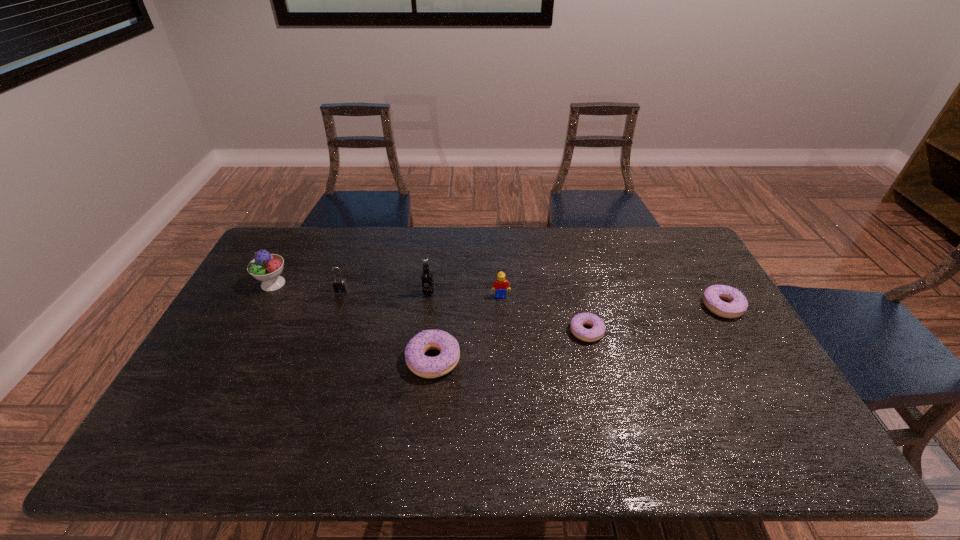
Where is `vacant space located on the left of the tallest doughnut`? The height and width of the screenshot is (540, 960). vacant space located on the left of the tallest doughnut is located at coordinates (325, 360).

At what (x,y) coordinates should I click in order to perform the action: click on free space located 0.260m on the right of the second doughnut from right to left. Please return your answer as a coordinate pair (x, y). Looking at the image, I should click on (693, 332).

This screenshot has height=540, width=960. What are the coordinates of `vacant space located 0.350m on the back of the rightmost object` in the screenshot? It's located at (678, 230).

The height and width of the screenshot is (540, 960). What are the coordinates of `free space located 0.300m on the front-facing side of the third object from right to left` in the screenshot? It's located at (505, 377).

Locate an element on the screen. This screenshot has height=540, width=960. free space located on the back of the leftmost object is located at coordinates (300, 232).

The height and width of the screenshot is (540, 960). I want to click on vacant area located on the shackle of the sixth object from right to left, so click(315, 366).

I want to click on free location located on the label of the root beer, so click(426, 309).

Where is `object located at the left edge`? Image resolution: width=960 pixels, height=540 pixels. object located at the left edge is located at coordinates (265, 267).

Locate an element on the screen. Image resolution: width=960 pixels, height=540 pixels. object at the right edge is located at coordinates (x=714, y=294).

The image size is (960, 540). Find the location of `vacant area at the far edge of the desktop`. vacant area at the far edge of the desktop is located at coordinates (442, 241).